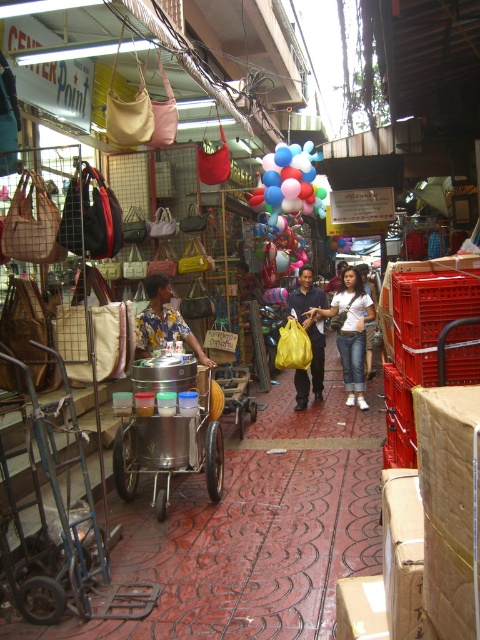
You are a customer at the market and want to carry both the white cotton shirt at center and the matte yellow bag at center in one hand. Can you fit both items side by side in your hand without overlapping?

The white cotton shirt at center might be wider than matte yellow bag at center, so it is uncertain if they can fit side by side in one hand without overlapping. Check their combined width against your hand size.